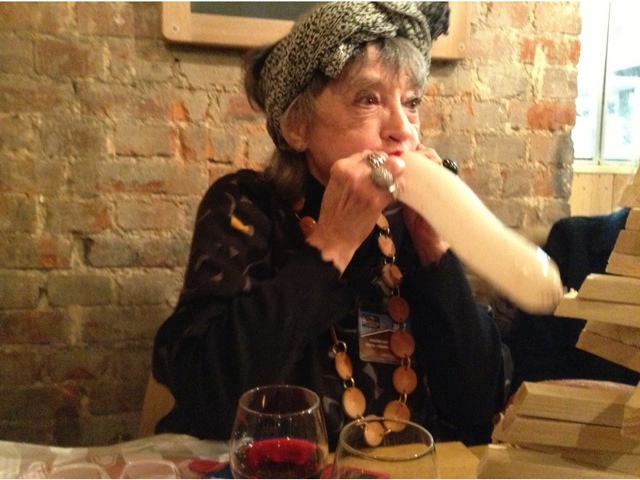
At what (x,y) coordinates should I click in order to perform the action: click on brick wall. Please return your answer as a coordinate pair (x, y). This screenshot has width=640, height=480. Looking at the image, I should click on (113, 175).